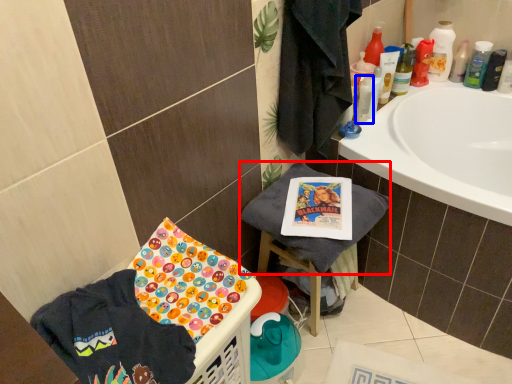
Question: Which point is further to the camera, beach towel (highlighted by a red box) or mouthwash (highlighted by a blue box)?

Choices:
 (A) beach towel
 (B) mouthwash

Answer: (B)